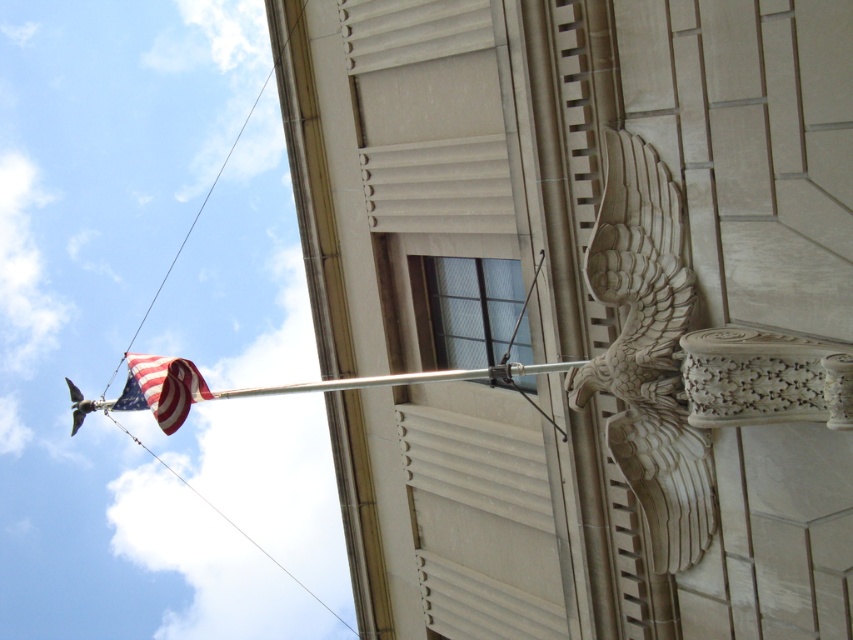
You are an architect analyzing the building facade. You need to place a new decorative element exactly at the midpoint between the carved stone eagle at upper right and the top edge of the building. What are the coordinates of this midpoint?

The carved stone eagle at upper right is located at coordinates point (647, 352). The top edge of the building is at point (0, 320). The midpoint between these two points is calculated by averaging the x and y coordinates. The midpoint coordinates are therefore (323, 336).

You are a photographer standing in front of the building. You want to take a picture that includes both the carved stone eagle at upper right and the american flag at upper left. Which object should you position closer to the top of your camera frame?

The carved stone eagle at upper right should be positioned closer to the top of your camera frame because it is located over the american flag at upper left.